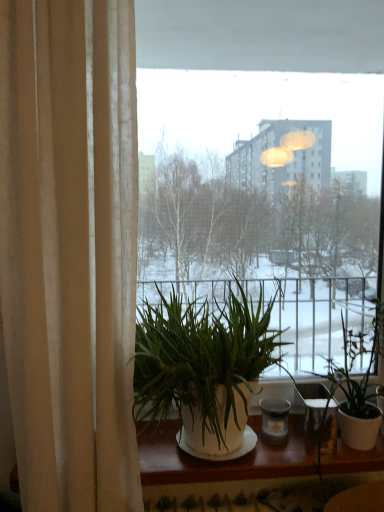
What is the approximate width of transparent glass window at center?

2.81 inches.

Identify the location of white matte window sill at lower center. The height and width of the screenshot is (512, 384). (221, 462).

Is green leafy plant at center, marked as the first houseplant in a left-to-right arrangement, a part of beige fabric curtain at left?

No, green leafy plant at center, marked as the first houseplant in a left-to-right arrangement, is not inside beige fabric curtain at left.

Which houseplant is the 1st one when counting from the right side of the beige fabric curtain at left? Please provide its 2D coordinates.

[(202, 367)]

Would you say beige fabric curtain at left is a long distance from green leafy plant at center, marked as the first houseplant in a left-to-right arrangement?

No.

Identify the location of window sill lying on the left of green leafy plant at right, which ranks as the first houseplant in right-to-left order. This screenshot has height=512, width=384. (221, 462).

From a real-world perspective, is green leafy plant at right, which ranks as the first houseplant in right-to-left order, over white matte window sill at lower center?

Yes, from a real-world perspective, green leafy plant at right, which ranks as the first houseplant in right-to-left order, is on top of white matte window sill at lower center.

From the image's perspective, would you say green leafy plant at right, which ranks as the first houseplant in right-to-left order, is shown under white matte window sill at lower center?

Actually, green leafy plant at right, which ranks as the first houseplant in right-to-left order, appears above white matte window sill at lower center in the image.

Is green leafy plant at right, the second houseplant from the left, oriented away from white matte window sill at lower center?

No, green leafy plant at right, the second houseplant from the left, is not facing away from white matte window sill at lower center.

Looking at this image, from the image's perspective, is beige fabric curtain at left located above or below green leafy plant at right, which ranks as the first houseplant in right-to-left order?

Based on their image positions, beige fabric curtain at left is located above green leafy plant at right, which ranks as the first houseplant in right-to-left order.

Is beige fabric curtain at left facing towards green leafy plant at right, the second houseplant from the left?

No, beige fabric curtain at left is not aimed at green leafy plant at right, the second houseplant from the left.

Which object is further away from the camera taking this photo, beige fabric curtain at left or green leafy plant at right, the second houseplant from the left?

green leafy plant at right, the second houseplant from the left, is more distant.

Which is more to the right, beige fabric curtain at left or green leafy plant at right, which ranks as the first houseplant in right-to-left order?

green leafy plant at right, which ranks as the first houseplant in right-to-left order, is more to the right.

Could you tell me if green leafy plant at center, the 2th houseplant positioned from the right, is turned towards green leafy plant at right, the second houseplant from the left?

No, green leafy plant at center, the 2th houseplant positioned from the right, is not turned towards green leafy plant at right, the second houseplant from the left.

Identify the location of houseplant to the right of green leafy plant at center, marked as the first houseplant in a left-to-right arrangement. (357, 387).

Is green leafy plant at center, marked as the first houseplant in a left-to-right arrangement, not inside green leafy plant at right, the second houseplant from the left?

Indeed, green leafy plant at center, marked as the first houseplant in a left-to-right arrangement, is completely outside green leafy plant at right, the second houseplant from the left.

Image resolution: width=384 pixels, height=512 pixels. I want to click on window that appears above the green leafy plant at right, which ranks as the first houseplant in right-to-left order (from the image's perspective), so click(x=261, y=35).

Can you confirm if green leafy plant at right, which ranks as the first houseplant in right-to-left order, is smaller than transparent glass window at center?

Indeed, green leafy plant at right, which ranks as the first houseplant in right-to-left order, has a smaller size compared to transparent glass window at center.

Who is more distant, green leafy plant at right, the second houseplant from the left, or transparent glass window at center?

transparent glass window at center is behind.

From a real-world perspective, is green leafy plant at right, the second houseplant from the left, positioned over transparent glass window at center based on gravity?

No, from a real-world perspective, green leafy plant at right, the second houseplant from the left, is not above transparent glass window at center.

Which object is positioned more to the right, green leafy plant at right, the second houseplant from the left, or beige fabric curtain at left?

green leafy plant at right, the second houseplant from the left.

Is point (367, 386) positioned before point (133, 168)?

That is False.

This screenshot has height=512, width=384. What are the coordinates of `houseplant that is the 2nd one below the beige fabric curtain at left (from a real-world perspective)` in the screenshot? It's located at (357, 387).

Who is bigger, green leafy plant at right, which ranks as the first houseplant in right-to-left order, or beige fabric curtain at left?

With larger size is beige fabric curtain at left.

From a real-world perspective, who is located higher, beige fabric curtain at left or white matte window sill at lower center?

beige fabric curtain at left, from a real-world perspective.

Can you confirm if beige fabric curtain at left is bigger than white matte window sill at lower center?

Indeed, beige fabric curtain at left has a larger size compared to white matte window sill at lower center.

Would you say beige fabric curtain at left is outside white matte window sill at lower center?

beige fabric curtain at left lies outside white matte window sill at lower center's area.

Is beige fabric curtain at left aimed at white matte window sill at lower center?

No, beige fabric curtain at left is not turned towards white matte window sill at lower center.

Where is `curtain that appears in front of the green leafy plant at center, marked as the first houseplant in a left-to-right arrangement`? Image resolution: width=384 pixels, height=512 pixels. curtain that appears in front of the green leafy plant at center, marked as the first houseplant in a left-to-right arrangement is located at coordinates (69, 249).

Locate an element on the screen. The width and height of the screenshot is (384, 512). window sill directly beneath the green leafy plant at right, which ranks as the first houseplant in right-to-left order (from a real-world perspective) is located at coordinates (221, 462).

Considering their positions, is white matte window sill at lower center positioned further to transparent glass window at center than green leafy plant at right, the second houseplant from the left?

white matte window sill at lower center lies further to transparent glass window at center than the other object.

From the image, which object appears to be farther from green leafy plant at right, which ranks as the first houseplant in right-to-left order, white matte window sill at lower center or beige fabric curtain at left?

Based on the image, beige fabric curtain at left appears to be further to green leafy plant at right, which ranks as the first houseplant in right-to-left order.

Which object lies further to the anchor point white matte window sill at lower center, green leafy plant at right, the second houseplant from the left, or beige fabric curtain at left?

Based on the image, beige fabric curtain at left appears to be further to white matte window sill at lower center.

Estimate the real-world distances between objects in this image. Which object is closer to green leafy plant at right, which ranks as the first houseplant in right-to-left order, transparent glass window at center or white matte window sill at lower center?

white matte window sill at lower center is positioned closer to the anchor green leafy plant at right, which ranks as the first houseplant in right-to-left order.

Which object lies further to the anchor point beige fabric curtain at left, green leafy plant at center, marked as the first houseplant in a left-to-right arrangement, or green leafy plant at right, the second houseplant from the left?

Among the two, green leafy plant at right, the second houseplant from the left, is located further to beige fabric curtain at left.

Estimate the real-world distances between objects in this image. Which object is closer to green leafy plant at right, the second houseplant from the left, beige fabric curtain at left or white matte window sill at lower center?

white matte window sill at lower center is positioned closer to the anchor green leafy plant at right, the second houseplant from the left.

Based on their spatial positions, is beige fabric curtain at left or green leafy plant at right, the second houseplant from the left, further from white matte window sill at lower center?

Based on the image, beige fabric curtain at left appears to be further to white matte window sill at lower center.

Which object lies nearer to the anchor point green leafy plant at right, which ranks as the first houseplant in right-to-left order, white matte window sill at lower center or green leafy plant at center, the 2th houseplant positioned from the right?

The object closer to green leafy plant at right, which ranks as the first houseplant in right-to-left order, is white matte window sill at lower center.

At what (x,y) coordinates should I click in order to perform the action: click on curtain that lies between transparent glass window at center and white matte window sill at lower center from top to bottom. Please return your answer as a coordinate pair (x, y). The height and width of the screenshot is (512, 384). Looking at the image, I should click on (69, 249).

In order to click on window between beige fabric curtain at left and green leafy plant at right, which ranks as the first houseplant in right-to-left order in this screenshot , I will do `click(261, 35)`.

Image resolution: width=384 pixels, height=512 pixels. Identify the location of houseplant between beige fabric curtain at left and transparent glass window at center from left to right. (202, 367).

Locate an element on the screen. window sill located between green leafy plant at center, the 2th houseplant positioned from the right, and green leafy plant at right, which ranks as the first houseplant in right-to-left order, in the left-right direction is located at coordinates (221, 462).